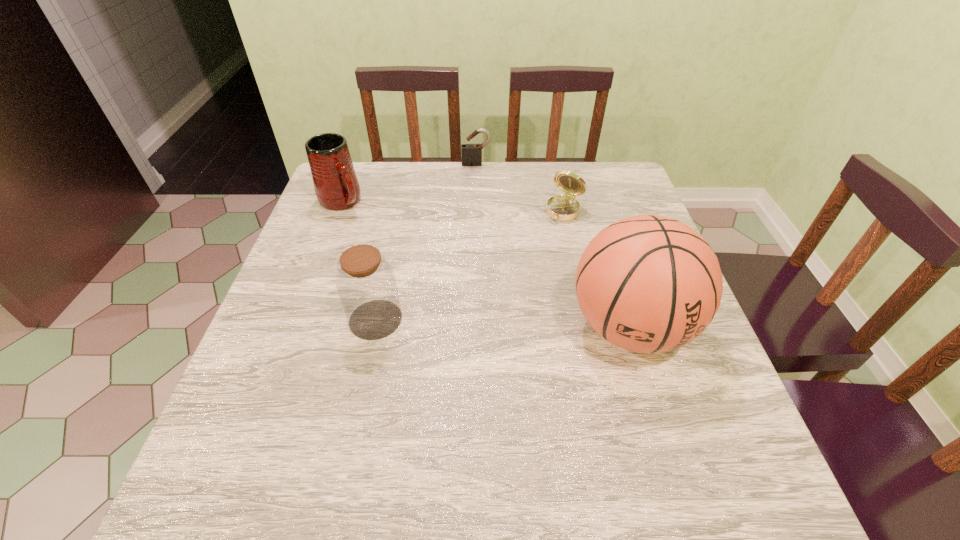
The width and height of the screenshot is (960, 540). Identify the location of object present at the left edge. (336, 185).

The height and width of the screenshot is (540, 960). Identify the location of object that is at the right edge. (649, 284).

The width and height of the screenshot is (960, 540). Find the location of `object present at the far left corner`. object present at the far left corner is located at coordinates (336, 185).

Locate an element on the screen. free space at the far edge of the desktop is located at coordinates (495, 208).

Where is `vacant space at the near edge of the desktop`? Image resolution: width=960 pixels, height=540 pixels. vacant space at the near edge of the desktop is located at coordinates (372, 433).

At what (x,y) coordinates should I click in order to perform the action: click on free space at the left edge of the desktop. Please return your answer as a coordinate pair (x, y). The width and height of the screenshot is (960, 540). Looking at the image, I should click on (273, 363).

I want to click on free spot at the right edge of the desktop, so click(672, 377).

The image size is (960, 540). In the image, there is a desktop. In order to click on vacant region at the far right corner in this screenshot , I will do `click(607, 168)`.

Where is `vacant space at the near right corner`? vacant space at the near right corner is located at coordinates (711, 405).

What are the coordinates of `vacant space that's between the third object from right to left and the basketball` in the screenshot? It's located at (553, 245).